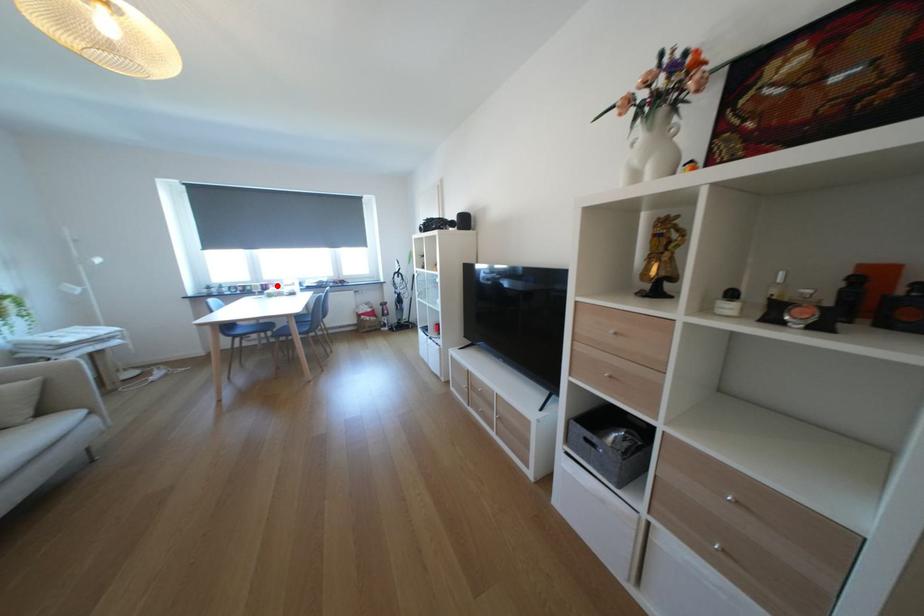
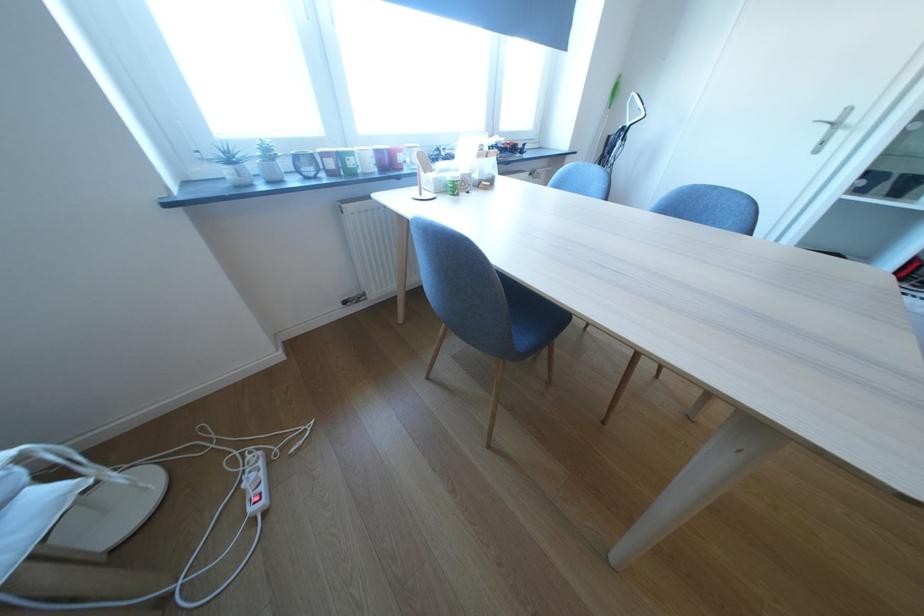
Locate, in the second image, the point that corresponds to the highlighted location in the first image.

(399, 151)